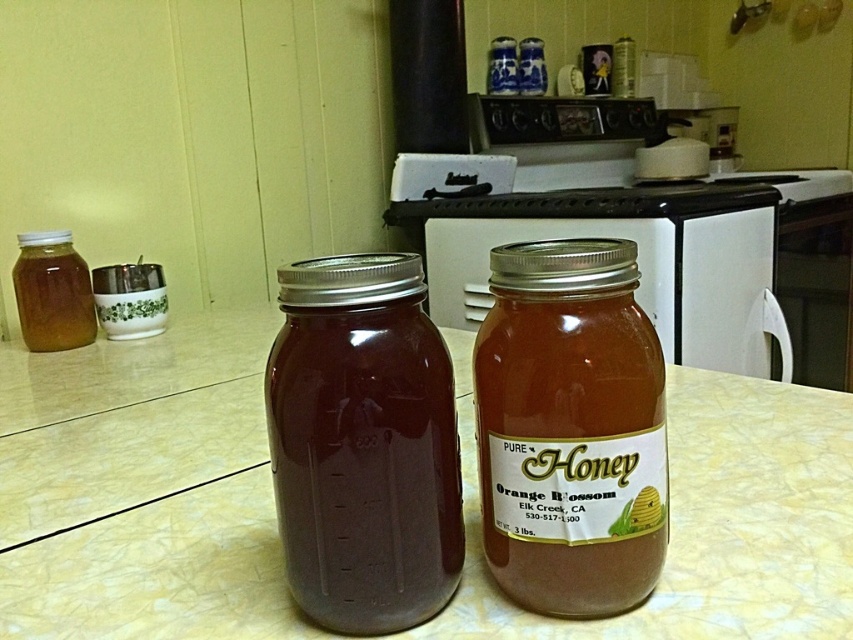
Does golden honey jar at center have a lesser height compared to brown glass jar at center?

Yes.

Which of these two, golden honey jar at center or brown glass jar at center, stands shorter?

Standing shorter between the two is golden honey jar at center.

Locate an element on the screen. This screenshot has height=640, width=853. golden honey jar at center is located at coordinates (570, 428).

Is point (708, 396) less distant than point (430, 596)?

No, (708, 396) is further to viewer.

Between translucent glass jar at center and brown glass jar at center, which one appears on the right side from the viewer's perspective?

brown glass jar at center is more to the right.

Is point (202, 403) more distant than point (376, 497)?

That is True.

You are a GUI agent. You are given a task and a screenshot of the screen. Output one action in this format:
    pyautogui.click(x=<x>, y=<y>)
    Task: Click on the translucent glass jar at center
    Image resolution: width=853 pixels, height=640 pixels.
    Given the screenshot: What is the action you would take?
    pyautogui.click(x=142, y=488)

Can you confirm if brown glass jar at center is taller than translucent amber honey jar at left?

In fact, brown glass jar at center may be shorter than translucent amber honey jar at left.

Is brown glass jar at center wider than translucent amber honey jar at left?

Incorrect, brown glass jar at center's width does not surpass translucent amber honey jar at left's.

This screenshot has height=640, width=853. What are the coordinates of `brown glass jar at center` in the screenshot? It's located at (363, 444).